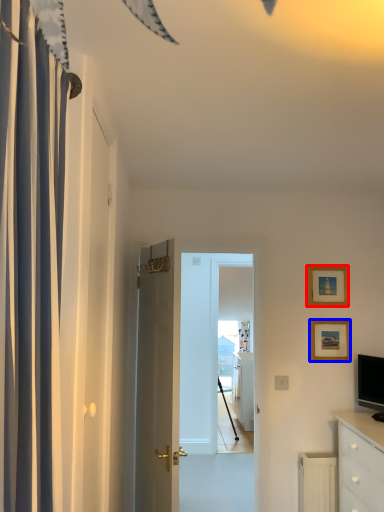
Question: Which object is further to the camera taking this photo, picture frame (highlighted by a red box) or picture frame (highlighted by a blue box)?

Choices:
 (A) picture frame
 (B) picture frame

Answer: (A)